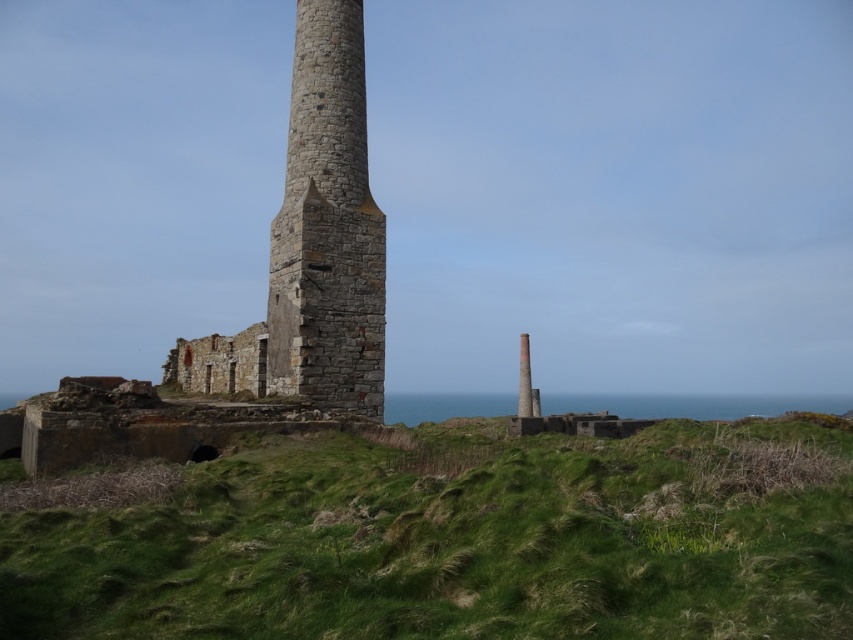
You are standing in front of the old industrial site and want to take a photo that includes both the point at coordinates point (585, 522) and point (318, 112). Since you want the closer point to be in focus, which point should you focus on?

You should focus on point (585, 522) because it is closer to the camera than point (318, 112).

You are standing at the base of the scene and want to reach the rustic stone tower at center. According to the image, which direction should you move relative to the green grassy at center?

You should move upward from the green grassy at center to reach the rustic stone tower at center since the green grassy at center is below the rustic stone tower at center.